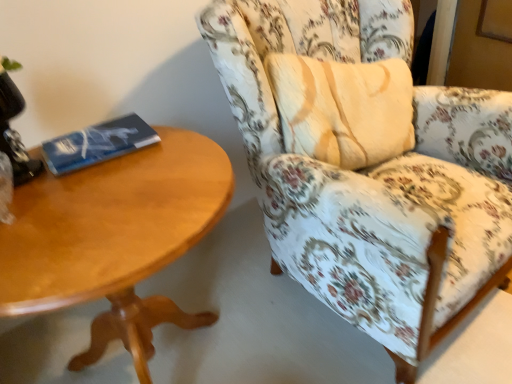
Question: Is blue matte paperback book at left positioned with its back to floral fabric chair at right?

Choices:
 (A) no
 (B) yes

Answer: (A)

Question: Is blue matte paperback book at left oriented towards floral fabric chair at right?

Choices:
 (A) no
 (B) yes

Answer: (A)

Question: Does blue matte paperback book at left have a larger size compared to floral fabric chair at right?

Choices:
 (A) yes
 (B) no

Answer: (B)

Question: Is blue matte paperback book at left at the right side of floral fabric chair at right?

Choices:
 (A) yes
 (B) no

Answer: (B)

Question: Can you confirm if blue matte paperback book at left is wider than floral fabric chair at right?

Choices:
 (A) yes
 (B) no

Answer: (B)

Question: Is point (16, 241) positioned closer to the camera than point (96, 132)?

Choices:
 (A) farther
 (B) closer

Answer: (B)

Question: Is light brown wood coffee table at left wider or thinner than blue matte paperback book at left?

Choices:
 (A) thin
 (B) wide

Answer: (B)

Question: Considering the relative positions of light brown wood coffee table at left and blue matte paperback book at left in the image provided, is light brown wood coffee table at left to the left or to the right of blue matte paperback book at left?

Choices:
 (A) right
 (B) left

Answer: (A)

Question: Is light brown wood coffee table at left situated inside blue matte paperback book at left or outside?

Choices:
 (A) inside
 (B) outside

Answer: (B)

Question: Relative to black glass table lamp at upper left, is floral fabric chair at right in front or behind?

Choices:
 (A) behind
 (B) front

Answer: (B)

Question: Looking at the image, does floral fabric chair at right seem bigger or smaller compared to black glass table lamp at upper left?

Choices:
 (A) small
 (B) big

Answer: (B)

Question: Considering the positions of floral fabric chair at right and black glass table lamp at upper left in the image, is floral fabric chair at right wider or thinner than black glass table lamp at upper left?

Choices:
 (A) thin
 (B) wide

Answer: (B)

Question: From a real-world perspective, relative to black glass table lamp at upper left, is floral fabric chair at right vertically above or below?

Choices:
 (A) above
 (B) below

Answer: (B)

Question: In terms of size, does black glass table lamp at upper left appear bigger or smaller than light brown wood coffee table at left?

Choices:
 (A) big
 (B) small

Answer: (B)

Question: In terms of width, does black glass table lamp at upper left look wider or thinner when compared to light brown wood coffee table at left?

Choices:
 (A) wide
 (B) thin

Answer: (B)